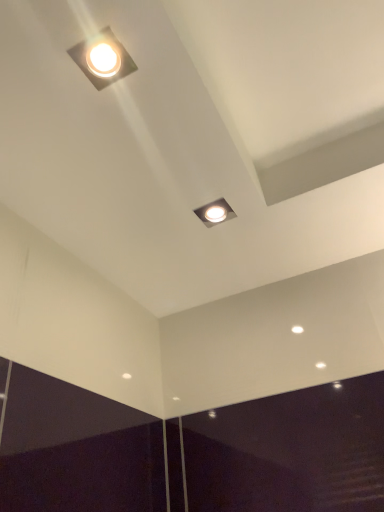
Question: Does matte white square light at upper left, which is the 2th lamp in bottom-to-top order, appear on the right side of matte silver square at center, placed as the second lamp when sorted from left to right?

Choices:
 (A) yes
 (B) no

Answer: (B)

Question: From a real-world perspective, does matte white square light at upper left, acting as the second lamp starting from the right, sit lower than matte silver square at center, which is counted as the first lamp, starting from the back?

Choices:
 (A) no
 (B) yes

Answer: (A)

Question: Is matte white square light at upper left, acting as the second lamp starting from the right, positioned with its back to matte silver square at center, which is counted as the first lamp, starting from the back?

Choices:
 (A) no
 (B) yes

Answer: (A)

Question: From the image's perspective, would you say matte white square light at upper left, which is the 2th lamp in bottom-to-top order, is positioned over matte silver square at center, placed as the second lamp when sorted from left to right?

Choices:
 (A) no
 (B) yes

Answer: (B)

Question: From the image's perspective, is matte white square light at upper left, acting as the second lamp starting from the right, beneath matte silver square at center, which is counted as the first lamp, starting from the back?

Choices:
 (A) no
 (B) yes

Answer: (A)

Question: Is the surface of matte white square light at upper left, marked as the 1th lamp in a left-to-right arrangement, in direct contact with matte silver square at center, the second lamp positioned from the front?

Choices:
 (A) yes
 (B) no

Answer: (B)

Question: Can you confirm if matte silver square at center, which is the second lamp in top-to-bottom order, is taller than matte white square light at upper left, which is the second lamp from back to front?

Choices:
 (A) no
 (B) yes

Answer: (A)

Question: From a real-world perspective, is matte silver square at center, which is counted as the first lamp, starting from the back, on top of matte white square light at upper left, which ranks as the 1th lamp in top-to-bottom order?

Choices:
 (A) yes
 (B) no

Answer: (B)

Question: Considering the relative positions of matte silver square at center, which is the second lamp in top-to-bottom order, and matte white square light at upper left, marked as the 1th lamp in a left-to-right arrangement, in the image provided, is matte silver square at center, which is the second lamp in top-to-bottom order, to the right of matte white square light at upper left, marked as the 1th lamp in a left-to-right arrangement, from the viewer's perspective?

Choices:
 (A) yes
 (B) no

Answer: (A)

Question: Does matte silver square at center, which is the second lamp in top-to-bottom order, have a smaller size compared to matte white square light at upper left, marked as the 1th lamp in a left-to-right arrangement?

Choices:
 (A) yes
 (B) no

Answer: (A)

Question: Is matte silver square at center, placed as the second lamp when sorted from left to right, to the left of matte white square light at upper left, which is the 2th lamp in bottom-to-top order, from the viewer's perspective?

Choices:
 (A) yes
 (B) no

Answer: (B)

Question: Is matte silver square at center, placed as the second lamp when sorted from left to right, positioned far away from matte white square light at upper left, which is the second lamp from back to front?

Choices:
 (A) yes
 (B) no

Answer: (B)

Question: From a real-world perspective, is matte white square light at upper left, acting as the second lamp starting from the right, above or below matte silver square at center, which is counted as the first lamp, starting from the back?

Choices:
 (A) above
 (B) below

Answer: (A)